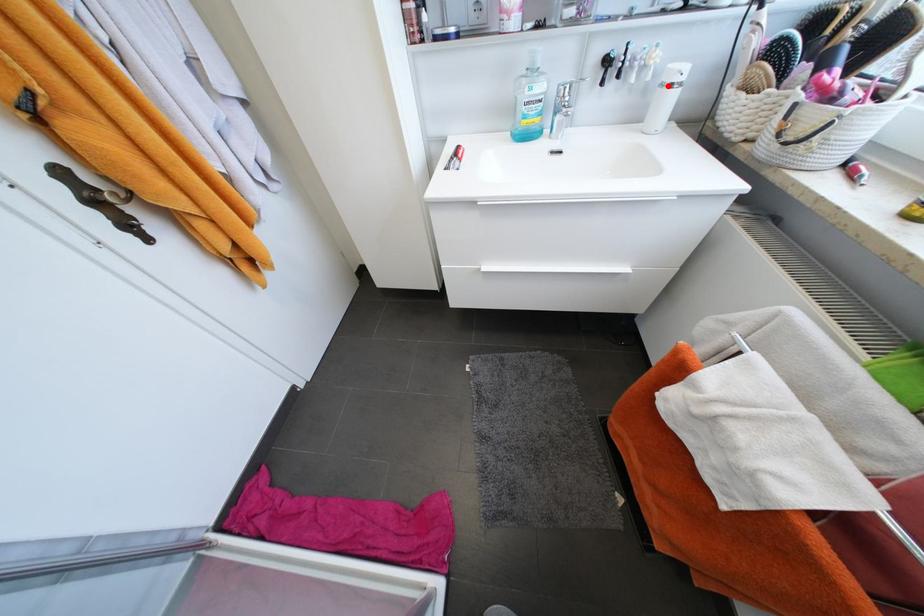
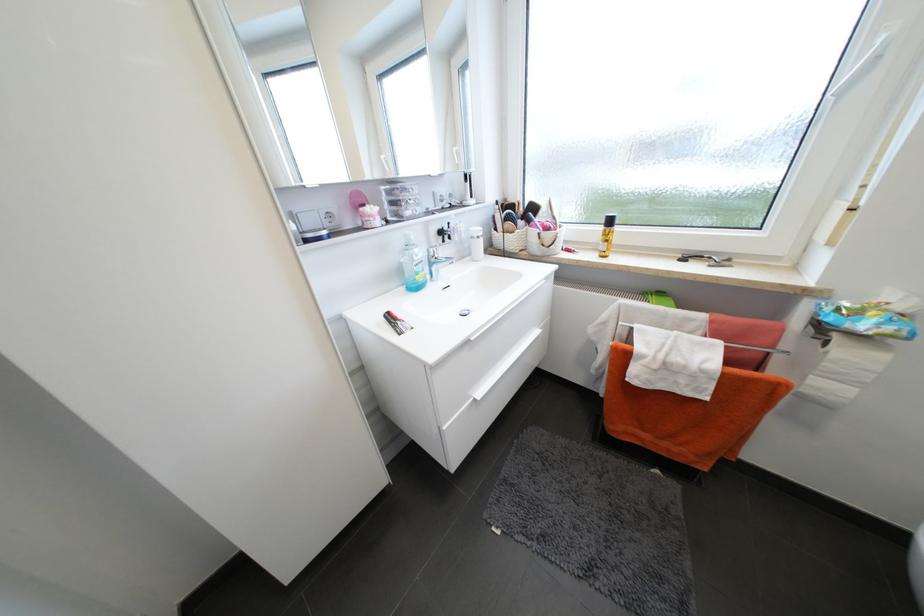
Locate, in the second image, the point that corresponds to the highlighted location in the first image.

(478, 238)